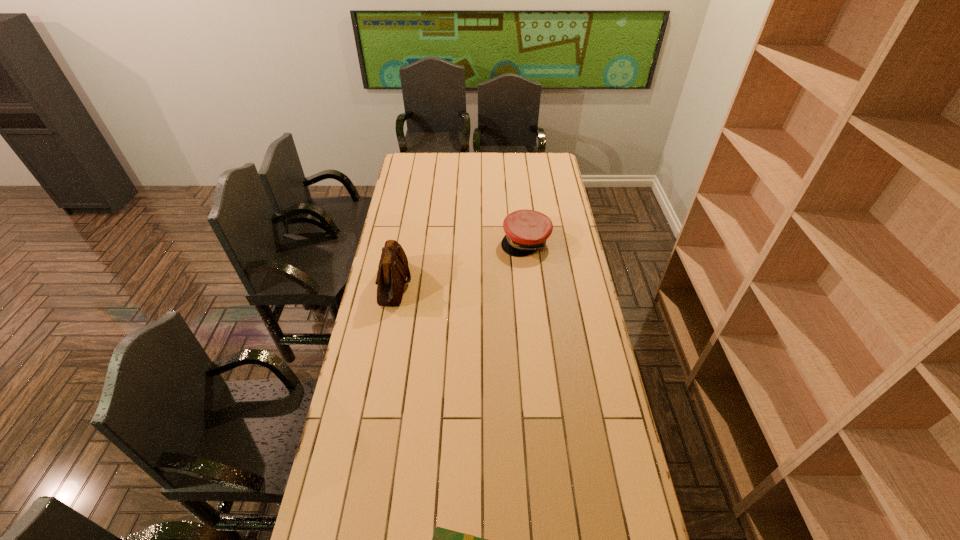
This screenshot has width=960, height=540. I want to click on the leftmost object, so click(393, 269).

The image size is (960, 540). Identify the location of the second nearest object. (393, 269).

Locate an element on the screen. cap is located at coordinates (527, 231).

At what (x,y) coordinates should I click in order to perform the action: click on the rightmost object. Please return your answer as a coordinate pair (x, y). Looking at the image, I should click on (527, 231).

Locate an element on the screen. The height and width of the screenshot is (540, 960). free space located 0.280m on the back of the shoulder bag is located at coordinates point(406,222).

The width and height of the screenshot is (960, 540). In order to click on free space located 0.080m at the front of the farthest object where the visor is located in this screenshot , I will do `click(529, 270)`.

This screenshot has width=960, height=540. I want to click on object present at the left edge, so click(x=393, y=269).

At what (x,y) coordinates should I click in order to perform the action: click on object positioned at the right edge. Please return your answer as a coordinate pair (x, y). The width and height of the screenshot is (960, 540). Looking at the image, I should click on (527, 231).

I want to click on vacant space at the far edge of the desktop, so click(x=447, y=158).

Identify the location of vacant region at the left edge of the desktop. (371, 375).